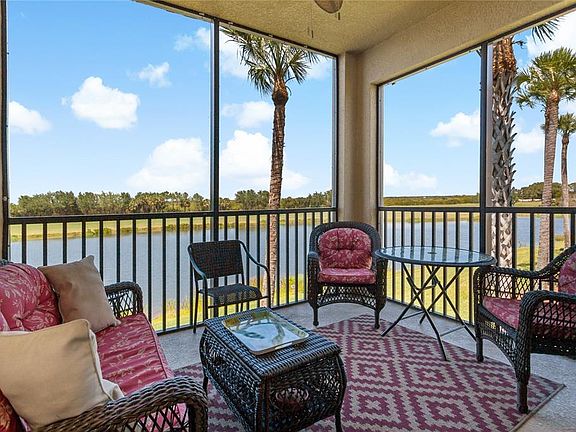
This screenshot has height=432, width=576. Identify the location of rug. (389, 403).